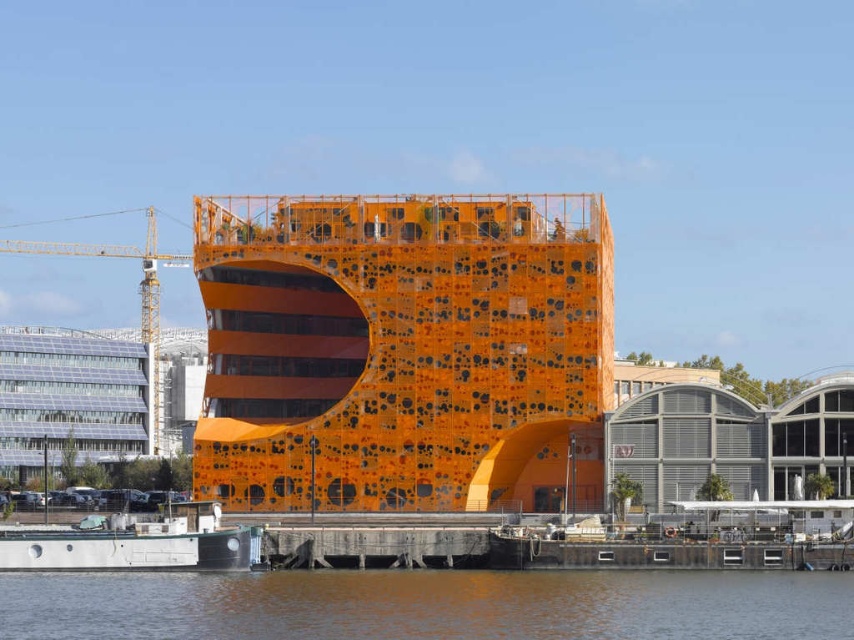
The width and height of the screenshot is (854, 640). Describe the element at coordinates (402, 352) in the screenshot. I see `orange matte building at center` at that location.

Who is more distant from viewer, [393,204] or [151,428]?

The point [151,428] is behind.

At what (x,y) coordinates should I click in order to perform the action: click on orange matte building at center. Please return your answer as a coordinate pair (x, y). Looking at the image, I should click on (402, 352).

Find the location of a particular element. orange matte building at center is located at coordinates (402, 352).

Who is positioned more to the left, orange matte building at center or concrete dock at lower center?

concrete dock at lower center is more to the left.

At what (x,y) coordinates should I click in order to perform the action: click on orange matte building at center. Please return your answer as a coordinate pair (x, y). Looking at the image, I should click on (402, 352).

Identify the location of orange matte building at center. This screenshot has width=854, height=640. (402, 352).

Between smooth orange water at lower center and concrete dock at lower center, which one appears on the right side from the viewer's perspective?

smooth orange water at lower center

Between smooth orange water at lower center and concrete dock at lower center, which one has more height?

concrete dock at lower center

What do you see at coordinates (428, 605) in the screenshot?
I see `smooth orange water at lower center` at bounding box center [428, 605].

Locate an element on the screen. The image size is (854, 640). smooth orange water at lower center is located at coordinates (428, 605).